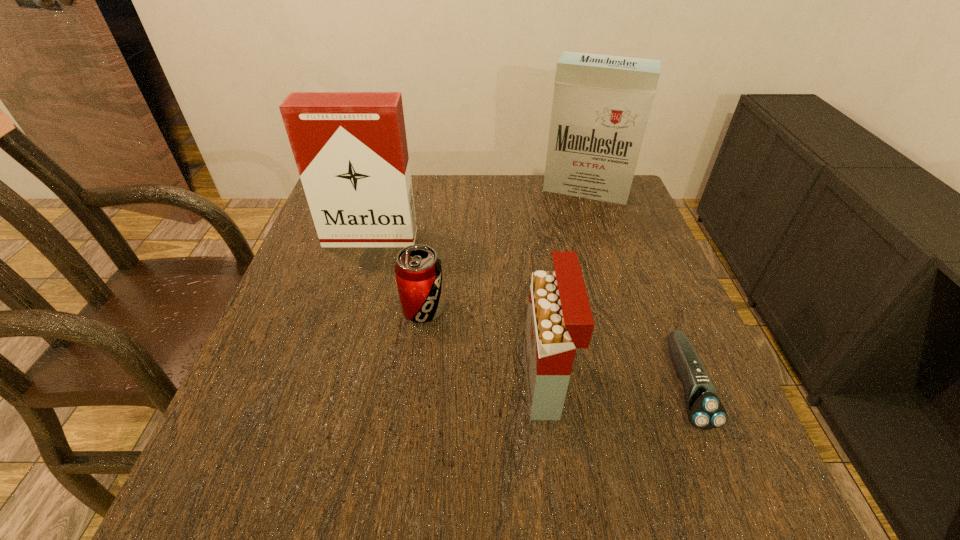
Where is `vacant space situated on the front-facing side of the second farthest cigarette case`? The image size is (960, 540). vacant space situated on the front-facing side of the second farthest cigarette case is located at coordinates (337, 350).

This screenshot has height=540, width=960. Find the location of `free point located 0.120m with the lid open on the second cigarette case from right to left`. free point located 0.120m with the lid open on the second cigarette case from right to left is located at coordinates (462, 382).

Find the location of a particular element. This screenshot has height=540, width=960. free space located 0.330m with the lid open on the second cigarette case from right to left is located at coordinates (348, 382).

Find the location of a particular element. The width and height of the screenshot is (960, 540). vacant space located with the lid open on the second cigarette case from right to left is located at coordinates (472, 382).

Locate an element on the screen. free space located 0.160m on the right of the second shortest object is located at coordinates (519, 309).

Find the location of a particular element. free point located on the head of the electric shaver is located at coordinates (716, 465).

Find the location of a particular element. This screenshot has height=540, width=960. object present at the far edge is located at coordinates (601, 104).

Where is `object situated at the left edge`? The width and height of the screenshot is (960, 540). object situated at the left edge is located at coordinates (350, 148).

Where is `cigarette case present at the right edge`? cigarette case present at the right edge is located at coordinates (601, 104).

Where is `electric shaver situated at the right edge`? electric shaver situated at the right edge is located at coordinates (705, 411).